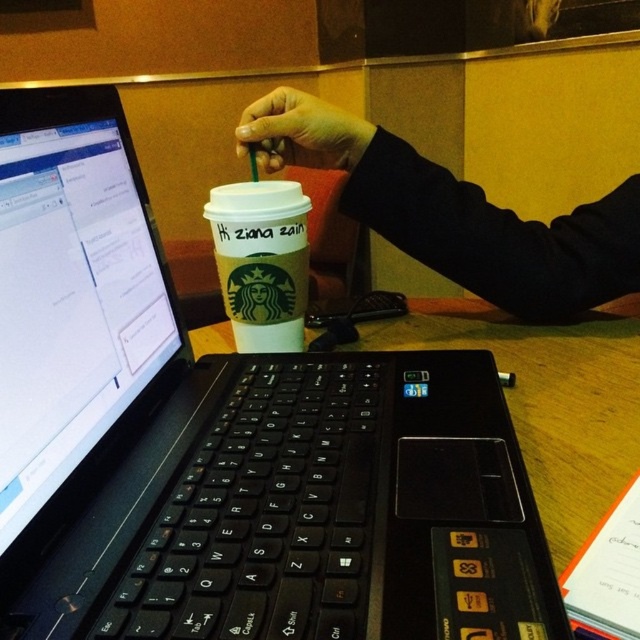
Question: Which point is farther from the camera taking this photo?

Choices:
 (A) (362, 131)
 (B) (465, 326)
 (C) (225, 198)

Answer: (B)

Question: Is matte plastic cup at center above smooth skin hand at upper center?

Choices:
 (A) yes
 (B) no

Answer: (B)

Question: Which of the following is the closest to the observer?

Choices:
 (A) white paper cup at center
 (B) wooden table at center
 (C) matte plastic cup at center
 (D) smooth skin hand at upper center

Answer: (B)

Question: Which point appears closest to the camera in this image?

Choices:
 (A) (513, 323)
 (B) (429, 202)
 (C) (266, 154)
 (D) (262, 304)

Answer: (D)

Question: Does matte plastic cup at center appear over smooth skin hand at upper center?

Choices:
 (A) no
 (B) yes

Answer: (A)

Question: Is the position of matte plastic cup at center more distant than that of wooden table at center?

Choices:
 (A) no
 (B) yes

Answer: (B)